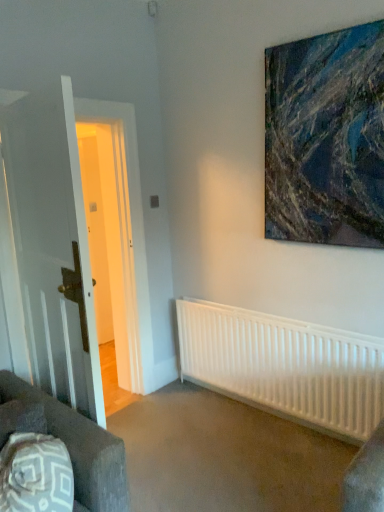
Question: Visually, is white wooden door at left positioned to the left or to the right of abstract painting at upper right?

Choices:
 (A) right
 (B) left

Answer: (B)

Question: Looking at their shapes, would you say white wooden door at left is wider or thinner than abstract painting at upper right?

Choices:
 (A) thin
 (B) wide

Answer: (B)

Question: Considering the real-world distances, which object is closest to the dark brown fabric couch at lower left?

Choices:
 (A) abstract painting at upper right
 (B) white matte radiator at lower center
 (C) white wooden door at left

Answer: (C)

Question: Which object is positioned closest to the white wooden door at left?

Choices:
 (A) dark brown fabric couch at lower left
 (B) white matte radiator at lower center
 (C) abstract painting at upper right

Answer: (A)